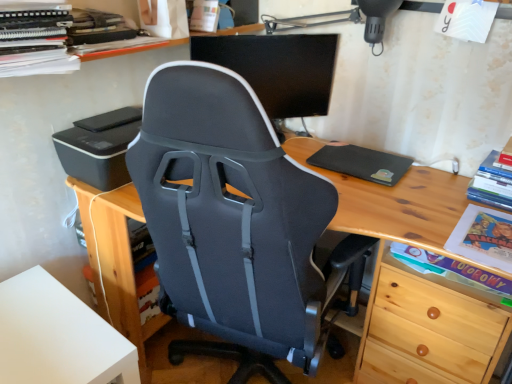
Question: In terms of width, does matte cardboard book at lower right, which is the 3th book from top to bottom, look wider or thinner when compared to white matte table at lower left?

Choices:
 (A) thin
 (B) wide

Answer: (A)

Question: Considering the relative positions of matte cardboard book at lower right, placed as the 1th book when sorted from bottom to top, and white matte table at lower left in the image provided, is matte cardboard book at lower right, placed as the 1th book when sorted from bottom to top, to the left or to the right of white matte table at lower left?

Choices:
 (A) right
 (B) left

Answer: (A)

Question: Estimate the real-world distances between objects in this image. Which object is closer to the hardcover book at right, the second book from the bottom?

Choices:
 (A) wooden desk at center
 (B) matte cardboard book at lower right, which ranks as the 2th book in left-to-right order
 (C) black plastic printer at left
 (D) white matte table at lower left
 (E) matte black chair at center

Answer: (A)

Question: Which is farther from the black matte monitor at center?

Choices:
 (A) black plastic printer at left
 (B) hardcover book at right, the second book from the bottom
 (C) black matte/black rubberized mousepad at right
 (D) matte black chair at center
 (E) white matte table at lower left

Answer: (E)